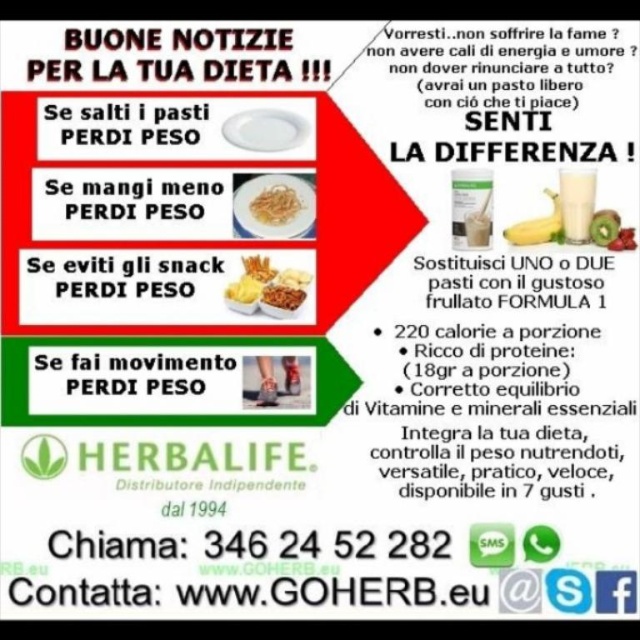
You are a food critic reviewing this Herbalife ad. You notice the shiny silver fork at upper center and the yellow crumbly snack at center. Which object is bigger in size?

The shiny silver fork at upper center is larger in size compared to the yellow crumbly snack at center.

Which object is wider, the shiny plastic snacks at center or the white creamy milkshake at right?

The shiny plastic snacks at center is wider than the white creamy milkshake at right.